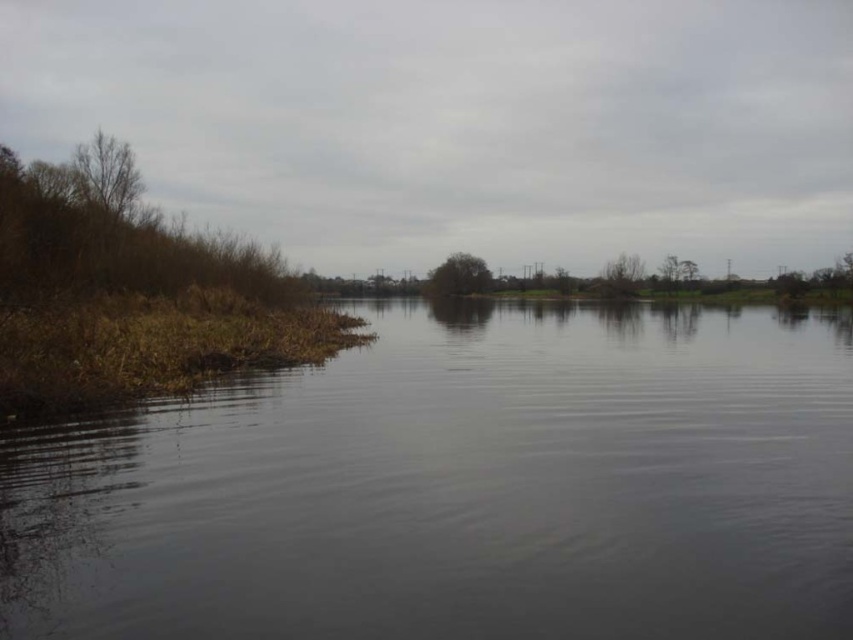
Question: Considering the real-world distances, which object is closest to the bare branches at left?

Choices:
 (A) green leafy tree at center
 (B) green matte tree at center
 (C) dark water at center

Answer: (C)

Question: Among these objects, which one is farthest from the camera?

Choices:
 (A) green matte tree at center
 (B) bare branches at left

Answer: (A)

Question: Estimate the real-world distances between objects in this image. Which object is closer to the bare branches at left?

Choices:
 (A) green leafy tree at center
 (B) dark water at center

Answer: (B)

Question: Can you confirm if dark water at center is smaller than green matte tree at center?

Choices:
 (A) yes
 (B) no

Answer: (A)

Question: Can you confirm if dark water at center is smaller than bare branches at left?

Choices:
 (A) yes
 (B) no

Answer: (B)

Question: Is green matte tree at center below green leafy tree at center?

Choices:
 (A) yes
 (B) no

Answer: (B)